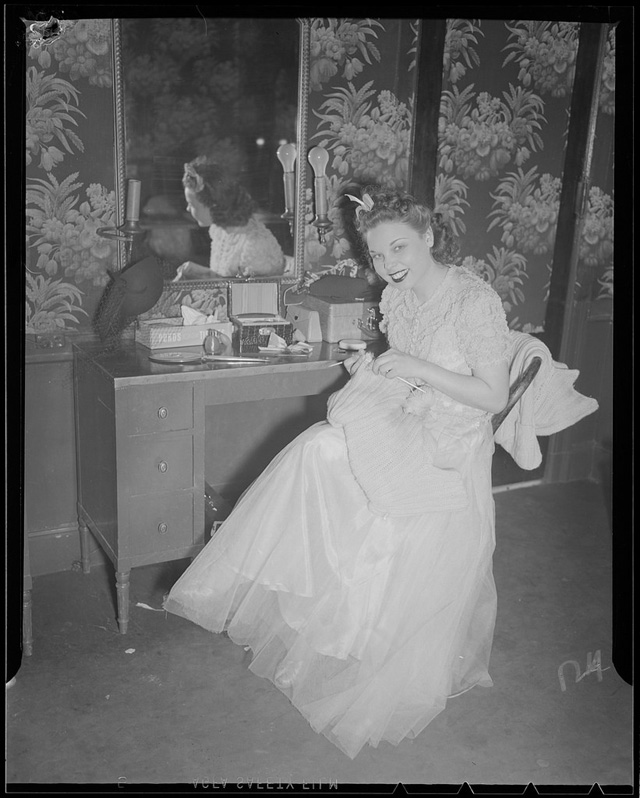
Locate an element on the screen. mirror is located at coordinates (241, 144).